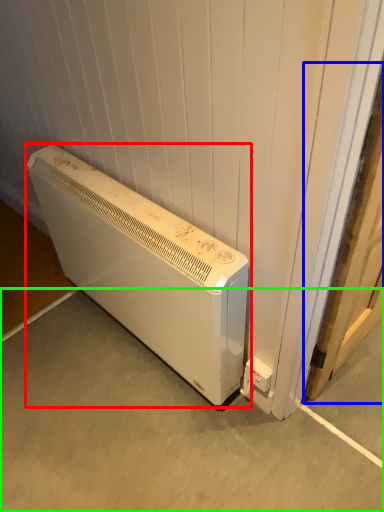
Question: Estimate the real-world distances between objects in this image. Which object is closer to home appliance (highlighted by a red box), door (highlighted by a blue box) or concrete (highlighted by a green box)?

Choices:
 (A) door
 (B) concrete

Answer: (B)